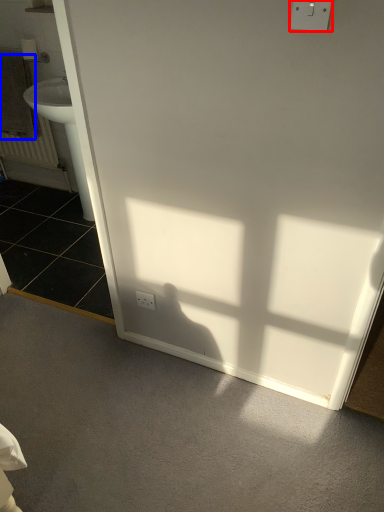
Question: Which of the following is the closest to the observer, electric outlet (highlighted by a red box) or towel/napkin (highlighted by a blue box)?

Choices:
 (A) electric outlet
 (B) towel/napkin

Answer: (A)